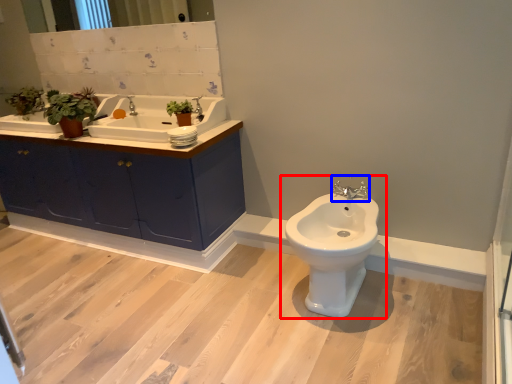
Question: Which object appears closest to the camera in this image, toilet (highlighted by a red box) or tap (highlighted by a blue box)?

Choices:
 (A) toilet
 (B) tap

Answer: (A)